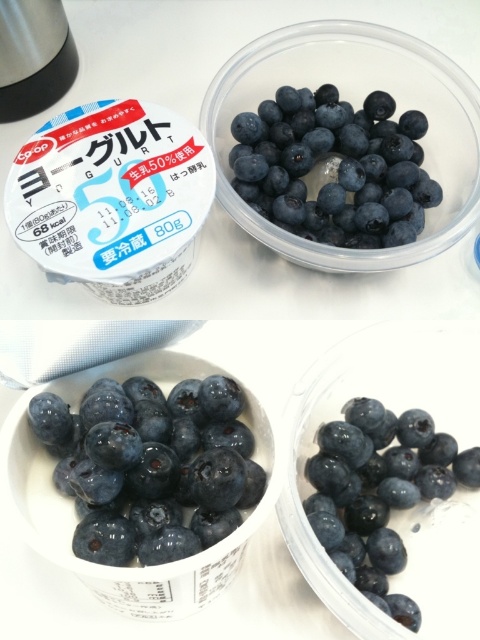
Question: Considering the relative positions of blueberry at center and shiny blueberry at center in the image provided, where is blueberry at center located with respect to shiny blueberry at center?

Choices:
 (A) below
 (B) above

Answer: (B)

Question: Does glossy blueberry at center lie in front of shiny blueberry at center?

Choices:
 (A) yes
 (B) no

Answer: (A)

Question: Which object is positioned closest to the shiny blueberry at center?

Choices:
 (A) blueberry at center
 (B) glossy blueberry at center

Answer: (B)

Question: Where is blueberry at center located in relation to shiny blueberry at center in the image?

Choices:
 (A) above
 (B) below

Answer: (A)

Question: Among these points, which one is nearest to the camera?

Choices:
 (A) (260, 470)
 (B) (283, 216)

Answer: (A)

Question: Among these objects, which one is nearest to the camera?

Choices:
 (A) shiny blueberry at center
 (B) blueberry at center

Answer: (A)